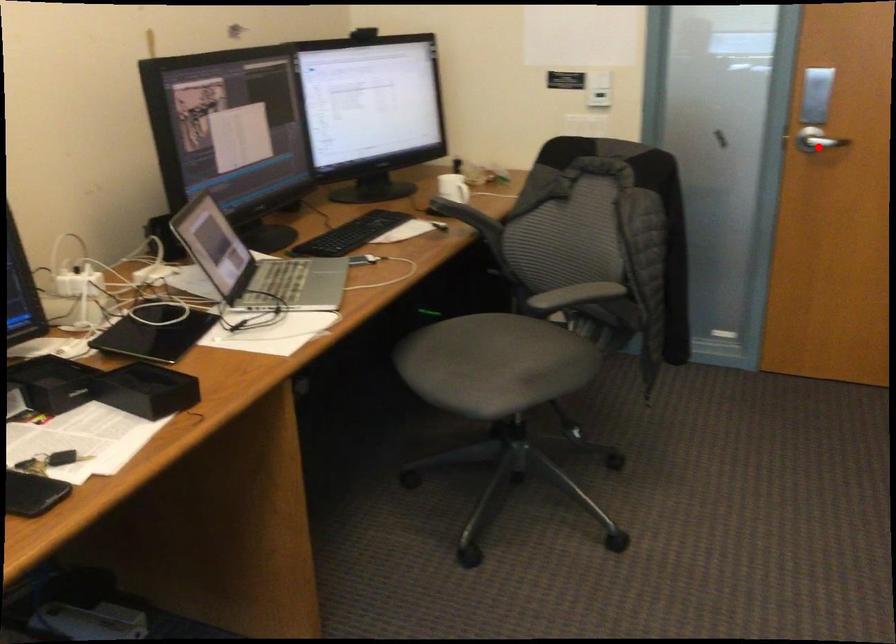
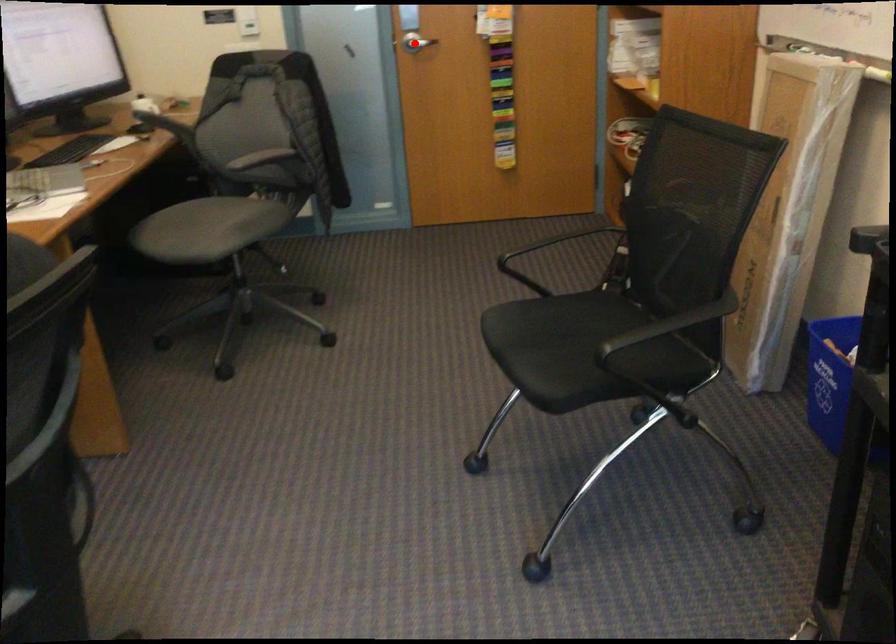
I am providing you with two images of the same scene from different viewpoints. A red point is marked on the first image and another point is marked on the second image. Do the highlighted points in image1 and image2 indicate the same real-world spot?

Yes